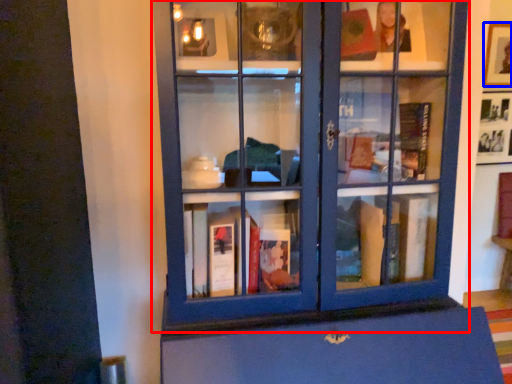
Question: Which point is further to the camera, bookcase (highlighted by a red box) or picture frame (highlighted by a blue box)?

Choices:
 (A) bookcase
 (B) picture frame

Answer: (B)